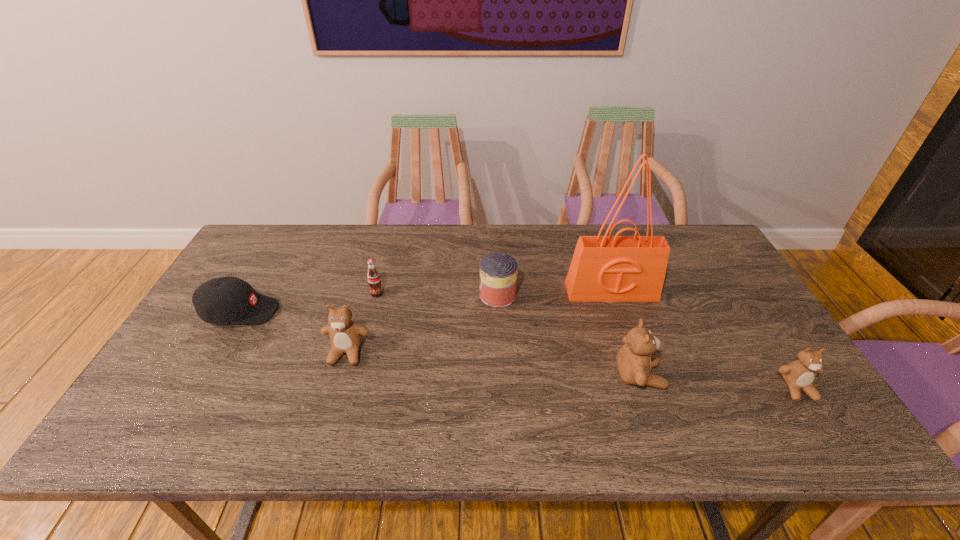
You are a GUI agent. You are given a task and a screenshot of the screen. Output one action in this format:
    pyautogui.click(x=<x>, y=<y>)
    Task: Click on the second tallest teddy bear
    
    Given the screenshot: What is the action you would take?
    pyautogui.click(x=345, y=335)

What are the coordinates of `the fifth shortest object` in the screenshot? It's located at (345, 335).

Identify the location of the second teddy bear from right to left. (634, 362).

Locate an element on the screen. the rightmost object is located at coordinates (799, 375).

In order to click on the rightmost teddy bear in this screenshot , I will do `click(799, 375)`.

You are a GUI agent. You are given a task and a screenshot of the screen. Output one action in this format:
    pyautogui.click(x=<x>, y=<y>)
    Task: Click on the can
    Image resolution: width=960 pixels, height=540 pixels.
    Given the screenshot: What is the action you would take?
    pyautogui.click(x=498, y=271)

This screenshot has width=960, height=540. In order to click on tote bag in this screenshot , I will do `click(605, 268)`.

Identify the location of baseball cap. (229, 299).

This screenshot has width=960, height=540. Find the location of `soda`. soda is located at coordinates (373, 276).

This screenshot has width=960, height=540. I want to click on vacant space located on the front-facing side of the fifth shortest object, so (331, 406).